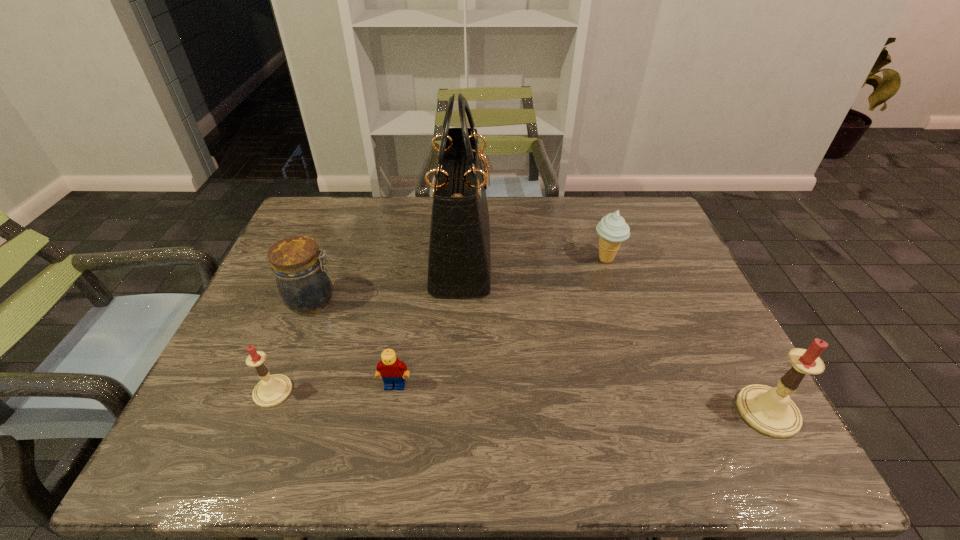
To ensure equal spacing by inserting another candle among them, please point out a vacant spot for this new candle. Please provide its 2D coordinates. Your answer should be formatted as a tuple, i.e. [(x, y)], where the tuple contains the x and y coordinates of a point satisfying the conditions above.

[(516, 401)]